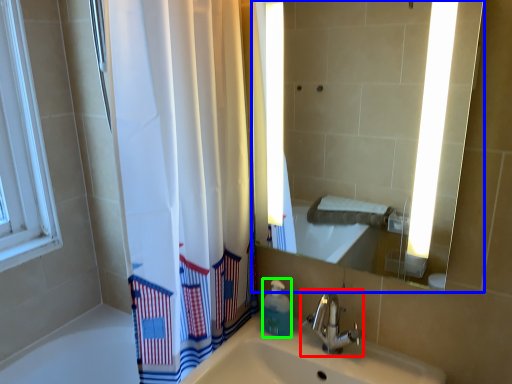
Question: Estimate the real-world distances between objects in this image. Which object is farther from tap (highlighted by a red box), mirror (highlighted by a blue box) or soap dispenser (highlighted by a green box)?

Choices:
 (A) mirror
 (B) soap dispenser

Answer: (A)